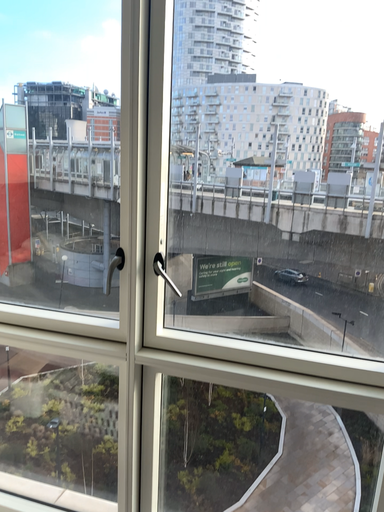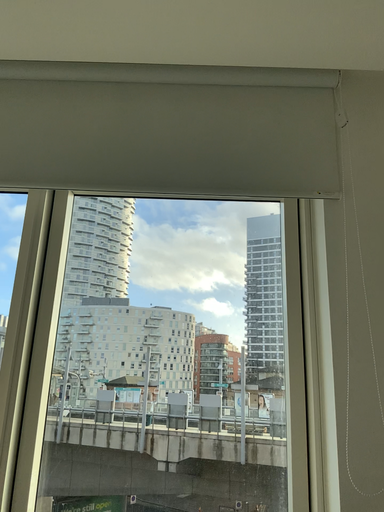
Question: Which way did the camera rotate in the video?

Choices:
 (A) rotated right
 (B) rotated left

Answer: (A)